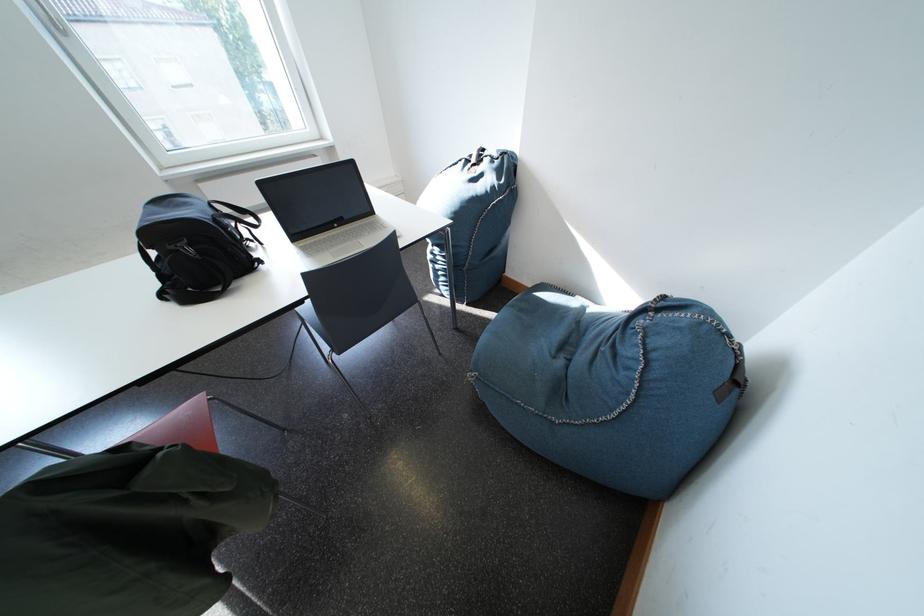
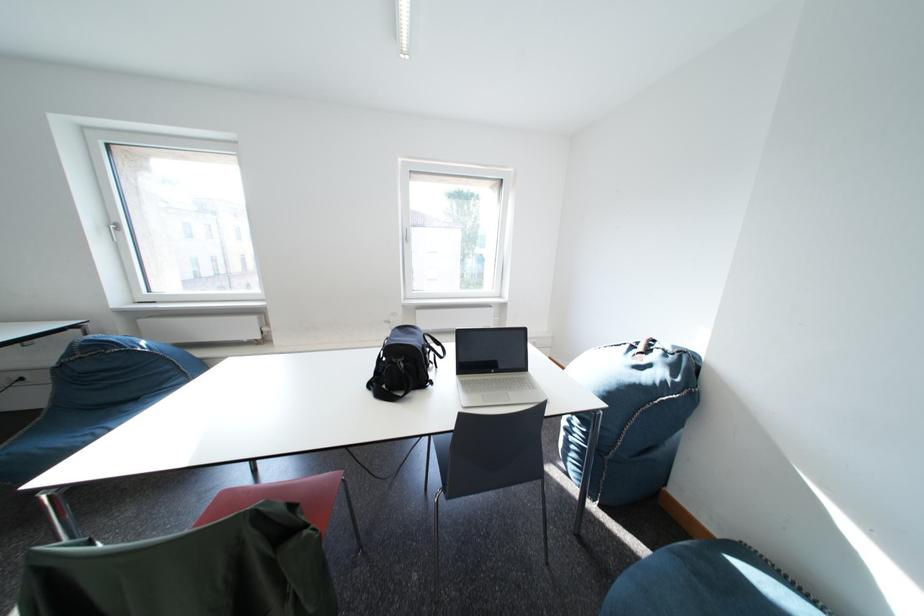
The first image is from the beginning of the video and the second image is from the end. How did the camera likely rotate when shooting the video?

The camera rotated toward left-up.